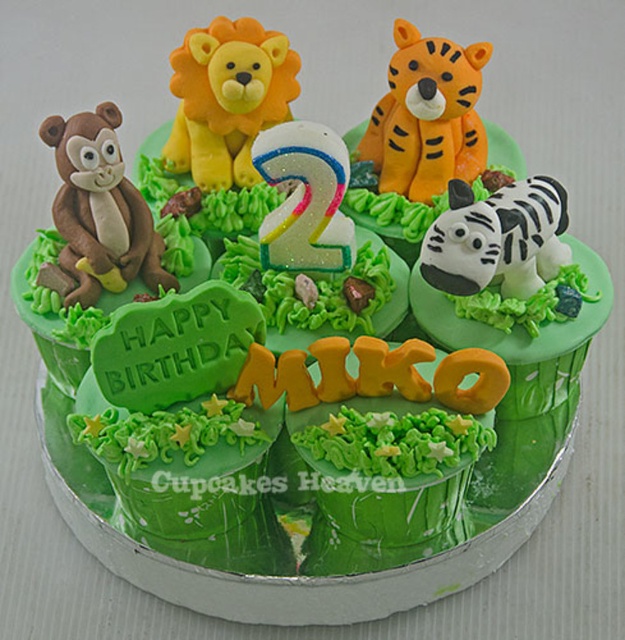
Does yellow fondant lion at upper center appear on the left side of white matte tiger at upper right?

Yes, yellow fondant lion at upper center is to the left of white matte tiger at upper right.

Who is positioned more to the right, yellow fondant lion at upper center or white matte tiger at upper right?

Positioned to the right is white matte tiger at upper right.

Image resolution: width=625 pixels, height=640 pixels. In order to click on yellow fondant lion at upper center in this screenshot , I will do `click(228, 99)`.

Looking at this image, can you confirm if orange matte tiger at upper right is smaller than white matte tiger at upper right?

No.

Does orange matte tiger at upper right appear on the right side of white matte tiger at upper right?

Incorrect, orange matte tiger at upper right is not on the right side of white matte tiger at upper right.

The width and height of the screenshot is (625, 640). Describe the element at coordinates (426, 116) in the screenshot. I see `orange matte tiger at upper right` at that location.

Identify the location of orange matte tiger at upper right. (426, 116).

Consider the image. Is matte brown monkey at left wider than white matte tiger at upper right?

No, matte brown monkey at left is not wider than white matte tiger at upper right.

Is matte brown monkey at left further to the viewer compared to white matte tiger at upper right?

Yes, it is.

Looking at this image, who is more distant from viewer, (156, 241) or (566, 259)?

The point (156, 241) is more distant.

The image size is (625, 640). What are the coordinates of `matte brown monkey at left` in the screenshot? It's located at (98, 212).